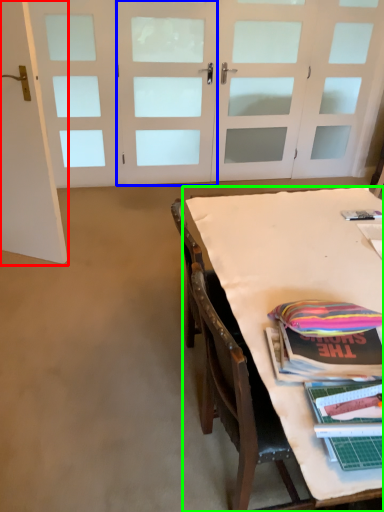
Question: Which object is the closest to the door (highlighted by a red box)? Choose among these: door (highlighted by a blue box) or table (highlighted by a green box).

Choices:
 (A) door
 (B) table

Answer: (B)